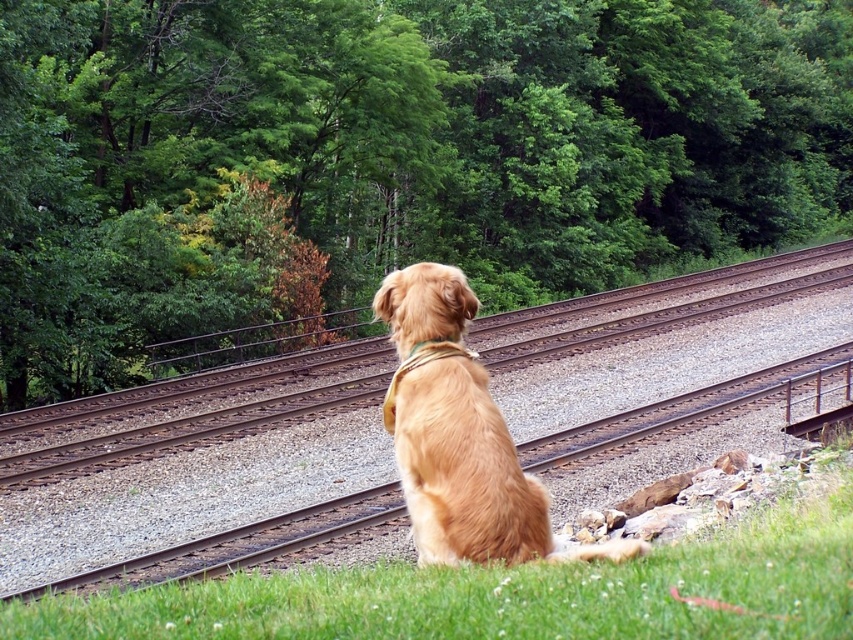
Question: Which point is closer to the camera?

Choices:
 (A) brown metal train track at center
 (B) golden fur dog at center
 (C) green soft grass at lower center
 (D) green leafy tree at center

Answer: (C)

Question: Does green leafy tree at center appear over golden fur dog at center?

Choices:
 (A) no
 (B) yes

Answer: (B)

Question: Is green leafy tree at center positioned in front of green soft grass at lower center?

Choices:
 (A) no
 (B) yes

Answer: (A)

Question: Which is farther from the brown metal train track at center?

Choices:
 (A) green soft grass at lower center
 (B) golden fur dog at center

Answer: (B)

Question: Does brown metal train track at center appear over green soft grass at lower center?

Choices:
 (A) no
 (B) yes

Answer: (B)

Question: Which of the following is the farthest from the observer?

Choices:
 (A) (105, 264)
 (B) (469, 529)

Answer: (A)